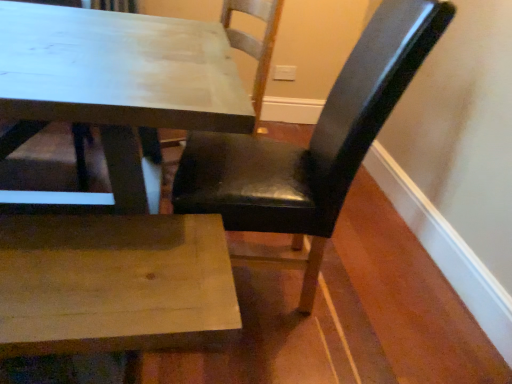
The image size is (512, 384). In order to click on free space above black leather chair at upper right, which is counted as the first chair, starting from the left (from a real-world perspective) in this screenshot , I will do `click(95, 56)`.